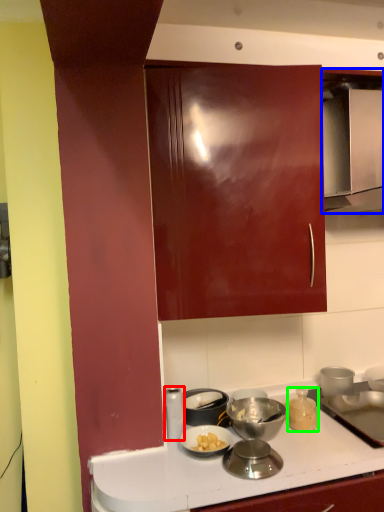
Question: Which is nearer to the kitchen appliance (highlighted by a red box)? home appliance (highlighted by a blue box) or kitchen appliance (highlighted by a green box).

Choices:
 (A) home appliance
 (B) kitchen appliance

Answer: (B)